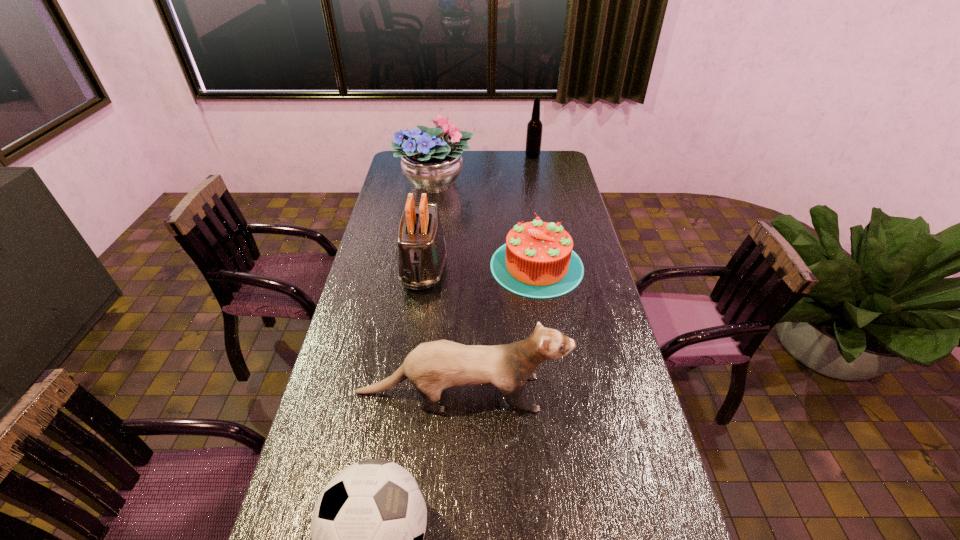
Locate an element on the screen. Image resolution: width=960 pixels, height=540 pixels. beer bottle at the far edge is located at coordinates (534, 127).

The height and width of the screenshot is (540, 960). Find the location of `bouquet positioned at the far edge`. bouquet positioned at the far edge is located at coordinates (432, 164).

The width and height of the screenshot is (960, 540). In order to click on bouquet that is at the left edge in this screenshot , I will do `click(432, 164)`.

Locate an element on the screen. Image resolution: width=960 pixels, height=540 pixels. toaster located at the left edge is located at coordinates (422, 254).

Find the location of a particular element. Image resolution: width=960 pixels, height=540 pixels. ferret located in the left edge section of the desktop is located at coordinates (434, 366).

Locate an element on the screen. This screenshot has width=960, height=540. beer bottle that is at the right edge is located at coordinates (534, 127).

Find the location of a particular element. The image size is (960, 540). cake positioned at the right edge is located at coordinates (537, 261).

At what (x,y) coordinates should I click in order to perform the action: click on object at the far left corner. Please return your answer as a coordinate pair (x, y). The image size is (960, 540). Looking at the image, I should click on (432, 164).

I want to click on object present at the far right corner, so click(x=534, y=127).

Locate an element on the screen. This screenshot has width=960, height=540. vacant space at the far edge is located at coordinates (507, 167).